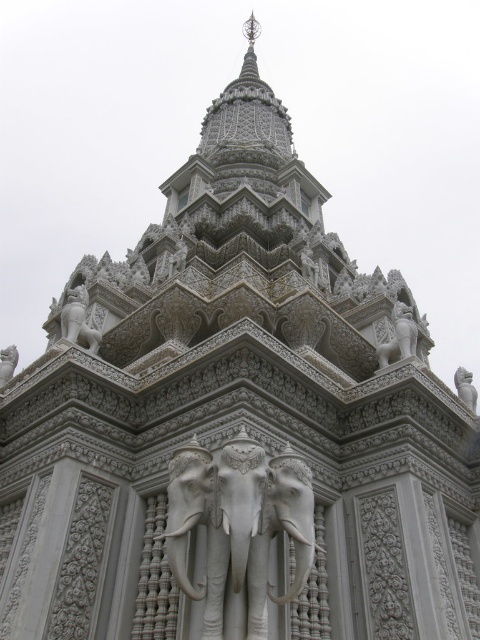
Question: Which object is positioned farthest from the white stone lion at upper right?

Choices:
 (A) white stone elephants at center
 (B) white stone lion at upper left

Answer: (B)

Question: Is white stone elephants at center bigger than white stone lion at upper right?

Choices:
 (A) yes
 (B) no

Answer: (B)

Question: Does white stone elephants at center come in front of white stone elephant at lower left?

Choices:
 (A) no
 (B) yes

Answer: (B)

Question: Which object appears farthest from the camera in this image?

Choices:
 (A) white stone lion at upper right
 (B) white stone elephants at center
 (C) white stone elephant at lower left
 (D) white stone lion at upper left

Answer: (C)

Question: Which object is the closest to the white stone elephants at center?

Choices:
 (A) white stone elephant at lower left
 (B) white stone lion at upper left
 (C) white stone lion at upper right

Answer: (B)

Question: Does white stone elephants at center have a greater width compared to white stone lion at upper left?

Choices:
 (A) yes
 (B) no

Answer: (A)